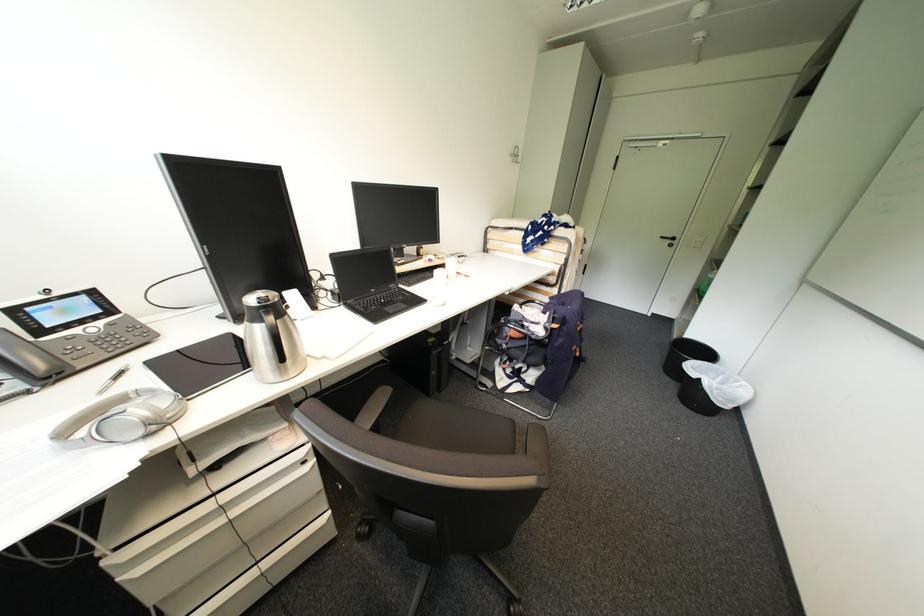
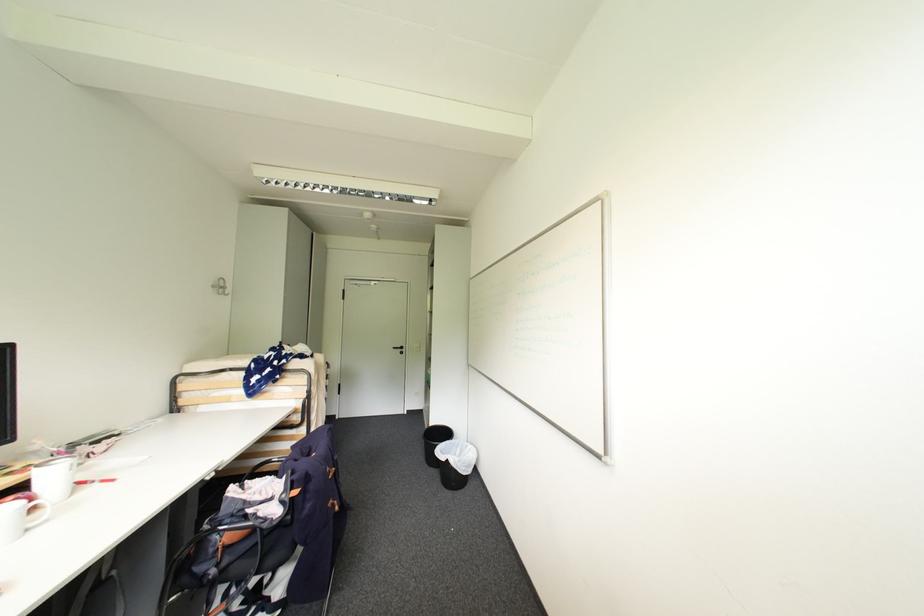
Find the pixel in the second image that matches [455,277] in the first image.

(41, 509)